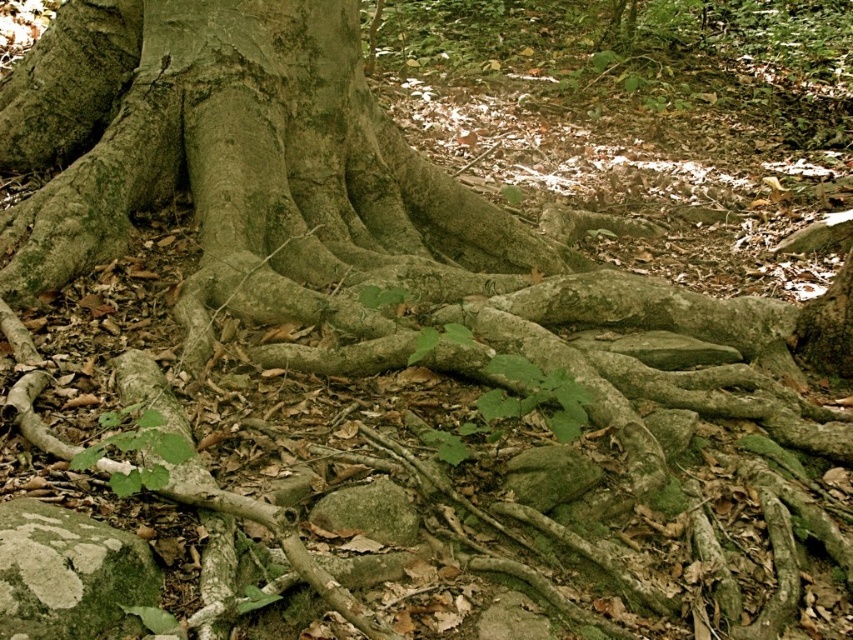
Does green mossy rock at lower left have a lesser width compared to green mossy rock at center?

In fact, green mossy rock at lower left might be wider than green mossy rock at center.

Does green mossy rock at lower left have a greater width compared to green mossy rock at center?

Yes.

Is point (28, 531) positioned behind point (369, 525)?

No.

Where is `green mossy rock at lower left`? Image resolution: width=853 pixels, height=640 pixels. green mossy rock at lower left is located at coordinates (68, 573).